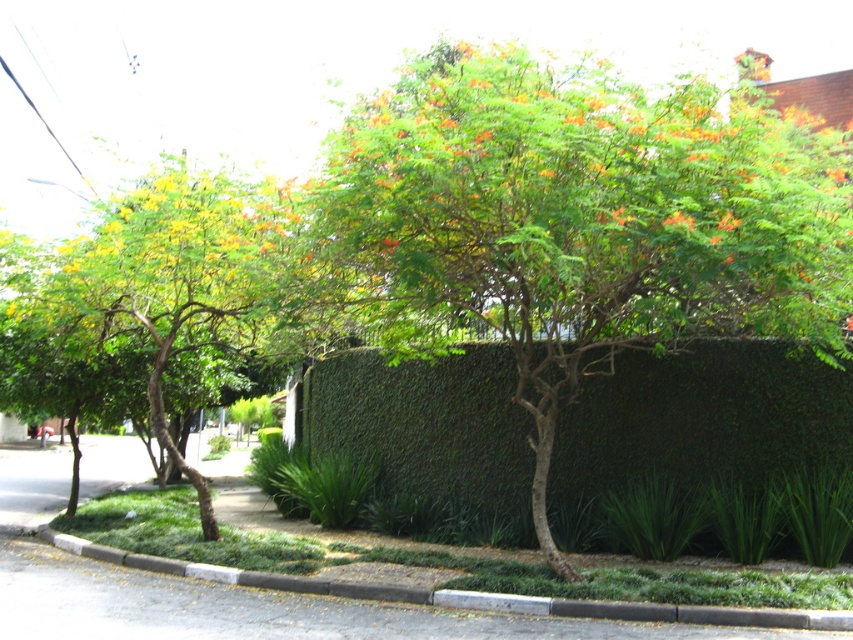
Question: Estimate the real-world distances between objects in this image. Which object is farther from the green leafy tree at center?

Choices:
 (A) gray concrete curb at lower center
 (B) green leafy hedge at center

Answer: (B)

Question: Where is green leafy tree at center located in relation to green leafy hedge at center in the image?

Choices:
 (A) above
 (B) below

Answer: (A)

Question: Can you confirm if green leafy hedge at center is wider than gray concrete curb at lower center?

Choices:
 (A) no
 (B) yes

Answer: (A)

Question: Which point is farther to the camera?

Choices:
 (A) green leafy tree at center
 (B) gray concrete curb at lower center
 (C) green leafy tree at left

Answer: (C)

Question: Which point appears closest to the camera in this image?

Choices:
 (A) (73, 333)
 (B) (445, 161)
 (C) (187, 564)
 (D) (445, 468)

Answer: (B)

Question: Does green leafy hedge at center come behind green leafy tree at left?

Choices:
 (A) yes
 (B) no

Answer: (A)